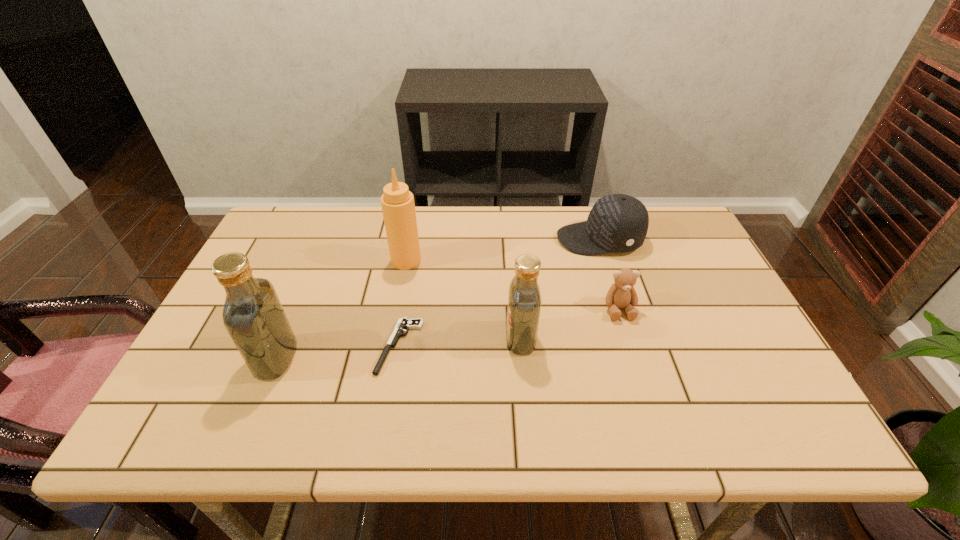
Find the location of a particular element. baseball cap that is at the far edge is located at coordinates (617, 222).

In order to click on vodka present at the near edge in this screenshot , I will do `click(253, 316)`.

At what (x,y) coordinates should I click in order to perform the action: click on pistol at the near edge. Please return your answer as a coordinate pair (x, y). Looking at the image, I should click on (403, 323).

Identify the location of object that is at the left edge. (253, 316).

This screenshot has width=960, height=540. What are the coordinates of `object present at the near left corner` in the screenshot? It's located at (253, 316).

You are a GUI agent. You are given a task and a screenshot of the screen. Output one action in this format:
    pyautogui.click(x=<x>, y=<y>)
    Task: Click on the vacant space at the far edge
    
    Given the screenshot: What is the action you would take?
    [477, 221]

Locate an element on the screen. vacant area at the near edge is located at coordinates (508, 395).

Where is `free space at the left edge of the desktop`? free space at the left edge of the desktop is located at coordinates (288, 270).

Locate an element on the screen. free space at the right edge is located at coordinates (734, 334).

This screenshot has width=960, height=540. I want to click on vacant space at the far left corner, so click(x=293, y=206).